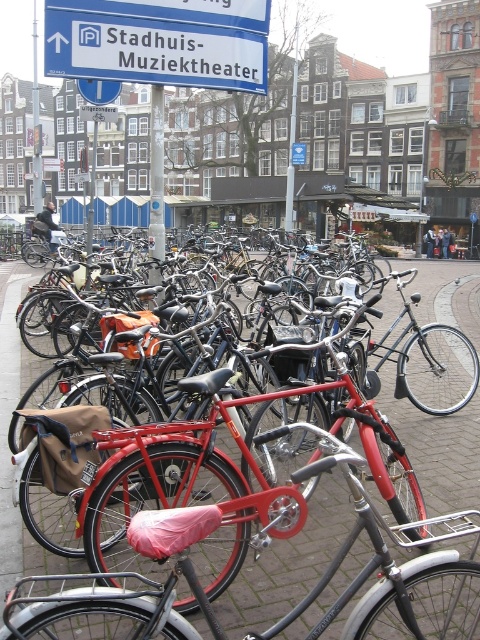
Can you confirm if blue plastic sign at upper center is wider than metallic pole at center?

Indeed, blue plastic sign at upper center has a greater width compared to metallic pole at center.

Is point (141, 4) positioned in front of point (163, 156)?

Yes, point (141, 4) is closer to viewer.

You are a GUI agent. You are given a task and a screenshot of the screen. Output one action in this format:
    pyautogui.click(x=<x>, y=<y>)
    Task: Click on the blue plastic sign at upper center
    
    Given the screenshot: What is the action you would take?
    pyautogui.click(x=159, y=42)

Between brick pavement at center and metallic pole at upper center, which one is positioned lower?

brick pavement at center is below.

Is brick pavement at center taller than metallic pole at upper center?

Incorrect, brick pavement at center's height is not larger of metallic pole at upper center's.

Is point (17, 552) more distant than point (34, 131)?

No, (17, 552) is closer to viewer.

Identify the location of brick pavement at center. (8, 458).

Describe the element at coordinates (159, 42) in the screenshot. The width and height of the screenshot is (480, 640). I see `blue plastic sign at upper center` at that location.

Does point (216, 74) lie in front of point (310, 560)?

No, it is not.

Is point (208, 65) positioned after point (429, 458)?

Yes, it is behind point (429, 458).

The width and height of the screenshot is (480, 640). I want to click on blue plastic sign at upper center, so click(x=159, y=42).